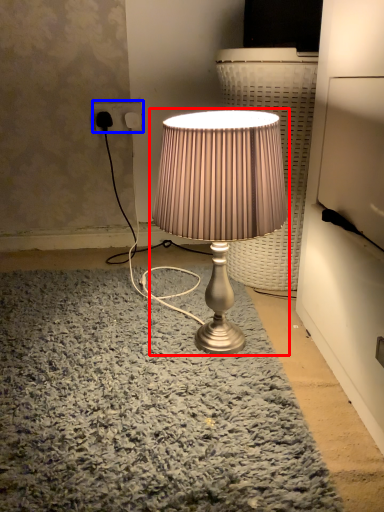
Question: Among these objects, which one is farthest to the camera, lamp (highlighted by a red box) or electric outlet (highlighted by a blue box)?

Choices:
 (A) lamp
 (B) electric outlet

Answer: (B)